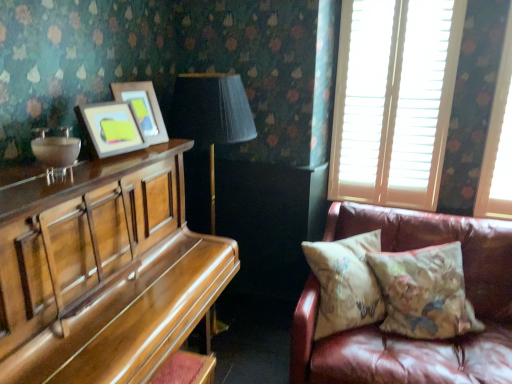
Describe the element at coordinates (403, 336) in the screenshot. I see `leather couch at right` at that location.

What are the coordinates of `leather couch at right` in the screenshot? It's located at (403, 336).

How much space does matte wooden picture frame at upper left, the second picture frame in the front-to-back sequence, occupy horizontally?

13.41 centimeters.

Find the location of a particular element. matte wooden picture frame at upper left, the second picture frame in the front-to-back sequence is located at coordinates (143, 108).

This screenshot has height=384, width=512. Identify the location of white wooden blinds at upper right. (394, 100).

Locate an element on the screen. This screenshot has width=512, height=384. leather couch at right is located at coordinates (403, 336).

Looking at this image, from a real-world perspective, which is physically above, matte wooden picture frame at upper left, the second picture frame in the front-to-back sequence, or floral-patterned fabric pillow at right, which appears as the 1th pillow when viewed from the left?

In real-world perspective, matte wooden picture frame at upper left, the second picture frame in the front-to-back sequence, is above.

From the image's perspective, would you say matte wooden picture frame at upper left, the second picture frame in the front-to-back sequence, is shown under floral-patterned fabric pillow at right, which appears as the 2th pillow when viewed from the right?

Incorrect, from the image's perspective, matte wooden picture frame at upper left, the second picture frame in the front-to-back sequence, is higher than floral-patterned fabric pillow at right, which appears as the 2th pillow when viewed from the right.

Between matte wooden picture frame at upper left, positioned as the 1th picture frame in back-to-front order, and floral-patterned fabric pillow at right, which appears as the 1th pillow when viewed from the left, which one has smaller width?

matte wooden picture frame at upper left, positioned as the 1th picture frame in back-to-front order, is thinner.

In the scene shown: Would you consider floral-patterned fabric pillow at right, marked as the 2th pillow in a left-to-right arrangement, to be distant from matte wooden picture frame at upper left, the 1th picture frame in the front-to-back sequence?

floral-patterned fabric pillow at right, marked as the 2th pillow in a left-to-right arrangement, is positioned a significant distance from matte wooden picture frame at upper left, the 1th picture frame in the front-to-back sequence.

Between point (460, 293) and point (99, 158), which one is positioned behind?

Point (460, 293)

Looking at the image, does floral-patterned fabric pillow at right, positioned as the 1th pillow in right-to-left order, seem bigger or smaller compared to matte wooden picture frame at upper left, the 1th picture frame in the front-to-back sequence?

floral-patterned fabric pillow at right, positioned as the 1th pillow in right-to-left order, is bigger than matte wooden picture frame at upper left, the 1th picture frame in the front-to-back sequence.

In the scene shown: How far apart are white wooden blinds at upper right and floral-patterned fabric pillow at right, marked as the 2th pillow in a left-to-right arrangement?

white wooden blinds at upper right is 32.86 inches away from floral-patterned fabric pillow at right, marked as the 2th pillow in a left-to-right arrangement.

Which object is wider, white wooden blinds at upper right or floral-patterned fabric pillow at right, positioned as the 1th pillow in right-to-left order?

floral-patterned fabric pillow at right, positioned as the 1th pillow in right-to-left order, is wider.

How many degrees apart are the facing directions of white wooden blinds at upper right and floral-patterned fabric pillow at right, positioned as the 1th pillow in right-to-left order?

The angle between the facing direction of white wooden blinds at upper right and the facing direction of floral-patterned fabric pillow at right, positioned as the 1th pillow in right-to-left order, is 25.1 degrees.

Is floral-patterned fabric pillow at right, positioned as the 1th pillow in right-to-left order, surrounded by white wooden blinds at upper right?

No, floral-patterned fabric pillow at right, positioned as the 1th pillow in right-to-left order, is not inside white wooden blinds at upper right.

How different are the orientations of floral-patterned fabric pillow at right, which appears as the 1th pillow when viewed from the left, and shiny brown piano at left in degrees?

There is a 43.9-degree angle between the facing directions of floral-patterned fabric pillow at right, which appears as the 1th pillow when viewed from the left, and shiny brown piano at left.

Consider the image. How far apart are floral-patterned fabric pillow at right, which appears as the 2th pillow when viewed from the right, and shiny brown piano at left?

floral-patterned fabric pillow at right, which appears as the 2th pillow when viewed from the right, is 72.77 centimeters away from shiny brown piano at left.

Considering the relative sizes of floral-patterned fabric pillow at right, which appears as the 1th pillow when viewed from the left, and shiny brown piano at left in the image provided, is floral-patterned fabric pillow at right, which appears as the 1th pillow when viewed from the left, thinner than shiny brown piano at left?

Indeed, floral-patterned fabric pillow at right, which appears as the 1th pillow when viewed from the left, has a lesser width compared to shiny brown piano at left.

Looking at this image, from a real-world perspective, which object stands above the other?

shiny brown piano at left.

Is floral-patterned fabric pillow at right, which appears as the 2th pillow when viewed from the right, bigger than matte wooden picture frame at upper left, the 1th picture frame in the front-to-back sequence?

Yes, floral-patterned fabric pillow at right, which appears as the 2th pillow when viewed from the right, is bigger than matte wooden picture frame at upper left, the 1th picture frame in the front-to-back sequence.

Does floral-patterned fabric pillow at right, which appears as the 2th pillow when viewed from the right, contain matte wooden picture frame at upper left, the 1th picture frame in the front-to-back sequence?

That's incorrect, matte wooden picture frame at upper left, the 1th picture frame in the front-to-back sequence, is not inside floral-patterned fabric pillow at right, which appears as the 2th pillow when viewed from the right.

Considering the sizes of floral-patterned fabric pillow at right, which appears as the 2th pillow when viewed from the right, and matte wooden picture frame at upper left, which is the 2th picture frame from back to front, in the image, is floral-patterned fabric pillow at right, which appears as the 2th pillow when viewed from the right, wider or thinner than matte wooden picture frame at upper left, which is the 2th picture frame from back to front,?

In the image, floral-patterned fabric pillow at right, which appears as the 2th pillow when viewed from the right, appears to be wider than matte wooden picture frame at upper left, which is the 2th picture frame from back to front.

In terms of height, does floral-patterned fabric pillow at right, which appears as the 1th pillow when viewed from the left, look taller or shorter compared to matte wooden picture frame at upper left, the 1th picture frame in the front-to-back sequence?

In the image, floral-patterned fabric pillow at right, which appears as the 1th pillow when viewed from the left, appears to be taller than matte wooden picture frame at upper left, the 1th picture frame in the front-to-back sequence.

Is point (95, 108) positioned after point (183, 252)?

No, it is in front of (183, 252).

Choose the correct answer: Is matte wooden picture frame at upper left, the 1th picture frame in the front-to-back sequence, inside shiny brown piano at left or outside it?

The correct answer is: outside.

From the image's perspective, which one is positioned lower, matte wooden picture frame at upper left, which is the 2th picture frame from back to front, or shiny brown piano at left?

shiny brown piano at left appears lower in the image.

The height and width of the screenshot is (384, 512). I want to click on piano located underneath the matte wooden picture frame at upper left, the 1th picture frame in the front-to-back sequence (from a real-world perspective), so pos(104,271).

Is matte wooden picture frame at upper left, positioned as the 1th picture frame in back-to-front order, bigger or smaller than leather couch at right?

matte wooden picture frame at upper left, positioned as the 1th picture frame in back-to-front order, is smaller than leather couch at right.

Looking at this image, from a real-world perspective, is matte wooden picture frame at upper left, positioned as the 1th picture frame in back-to-front order, physically above leather couch at right?

Yes.

Is matte wooden picture frame at upper left, the second picture frame in the front-to-back sequence, oriented towards leather couch at right?

No, matte wooden picture frame at upper left, the second picture frame in the front-to-back sequence, is not aimed at leather couch at right.

Find the location of a particular element. The width and height of the screenshot is (512, 384). the 2nd pillow below the matte wooden picture frame at upper left, the second picture frame in the front-to-back sequence (from the image's perspective) is located at coordinates (345, 283).

Find the location of a particular element. This screenshot has height=384, width=512. the 1st picture frame above the floral-patterned fabric pillow at right, marked as the 2th pillow in a left-to-right arrangement (from the image's perspective) is located at coordinates (110, 128).

Estimate the real-world distances between objects in this image. Which object is closer to white wooden blinds at upper right, matte wooden picture frame at upper left, which is the 2th picture frame from back to front, or shiny brown piano at left?

Based on the image, shiny brown piano at left appears to be nearer to white wooden blinds at upper right.

Estimate the real-world distances between objects in this image. Which object is further from floral-patterned fabric pillow at right, which appears as the 1th pillow when viewed from the left, matte wooden picture frame at upper left, which is the 2th picture frame from back to front, or floral-patterned fabric pillow at right, positioned as the 1th pillow in right-to-left order?

matte wooden picture frame at upper left, which is the 2th picture frame from back to front, lies further to floral-patterned fabric pillow at right, which appears as the 1th pillow when viewed from the left, than the other object.

From the image, which object appears to be nearer to white wooden blinds at upper right, leather couch at right or matte wooden picture frame at upper left, which is the 2th picture frame from back to front?

Based on the image, leather couch at right appears to be nearer to white wooden blinds at upper right.

Estimate the real-world distances between objects in this image. Which object is further from floral-patterned fabric pillow at right, which appears as the 2th pillow when viewed from the right, white wooden blinds at upper right or matte wooden picture frame at upper left, which is the 2th picture frame from back to front?

The object further to floral-patterned fabric pillow at right, which appears as the 2th pillow when viewed from the right, is matte wooden picture frame at upper left, which is the 2th picture frame from back to front.

Looking at the image, which one is located further to floral-patterned fabric pillow at right, marked as the 2th pillow in a left-to-right arrangement, floral-patterned fabric pillow at right, which appears as the 1th pillow when viewed from the left, or white wooden blinds at upper right?

Based on the image, white wooden blinds at upper right appears to be further to floral-patterned fabric pillow at right, marked as the 2th pillow in a left-to-right arrangement.

Estimate the real-world distances between objects in this image. Which object is further from floral-patterned fabric pillow at right, marked as the 2th pillow in a left-to-right arrangement, leather couch at right or white wooden blinds at upper right?

Among the two, white wooden blinds at upper right is located further to floral-patterned fabric pillow at right, marked as the 2th pillow in a left-to-right arrangement.

Considering their positions, is white wooden blinds at upper right positioned closer to floral-patterned fabric pillow at right, positioned as the 1th pillow in right-to-left order, than leather couch at right?

leather couch at right is closer to floral-patterned fabric pillow at right, positioned as the 1th pillow in right-to-left order.

Based on their spatial positions, is leather couch at right or floral-patterned fabric pillow at right, which appears as the 2th pillow when viewed from the right, further from matte wooden picture frame at upper left, which is the 2th picture frame from back to front?

leather couch at right.

Locate an element on the screen. The width and height of the screenshot is (512, 384). piano between matte wooden picture frame at upper left, the 1th picture frame in the front-to-back sequence, and floral-patterned fabric pillow at right, positioned as the 1th pillow in right-to-left order, in the horizontal direction is located at coordinates (104, 271).

Find the location of a particular element. Image resolution: width=512 pixels, height=384 pixels. studio couch between matte wooden picture frame at upper left, positioned as the 1th picture frame in back-to-front order, and white wooden blinds at upper right is located at coordinates (403, 336).

Where is `pillow between matte wooden picture frame at upper left, positioned as the 1th picture frame in back-to-front order, and floral-patterned fabric pillow at right, positioned as the 1th pillow in right-to-left order, from left to right`? pillow between matte wooden picture frame at upper left, positioned as the 1th picture frame in back-to-front order, and floral-patterned fabric pillow at right, positioned as the 1th pillow in right-to-left order, from left to right is located at coordinates (345, 283).

The image size is (512, 384). I want to click on picture frame between matte wooden picture frame at upper left, the 1th picture frame in the front-to-back sequence, and white wooden blinds at upper right, in the horizontal direction, so (x=143, y=108).